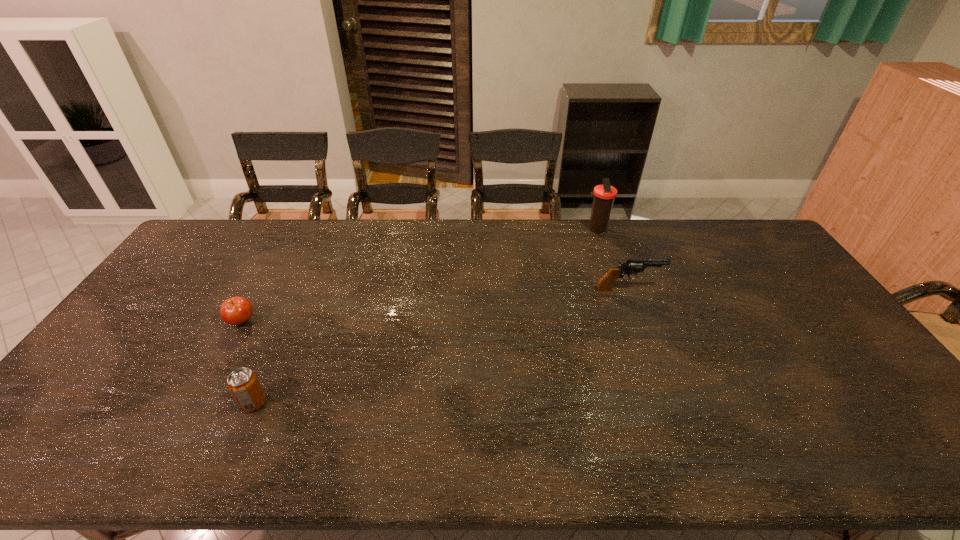
Locate an element on the screen. The width and height of the screenshot is (960, 540). the farthest object is located at coordinates (604, 195).

You are a GUI agent. You are given a task and a screenshot of the screen. Output one action in this format:
    pyautogui.click(x=<x>, y=<y>)
    Task: Click on the tallest object
    The height and width of the screenshot is (540, 960).
    Given the screenshot: What is the action you would take?
    pyautogui.click(x=604, y=195)

Find the location of a particular element. The width and height of the screenshot is (960, 540). the second tallest object is located at coordinates (632, 266).

I want to click on gun, so click(632, 266).

In order to click on the second shortest object in this screenshot , I will do `click(243, 384)`.

Find the location of a particular element. soda can is located at coordinates (243, 384).

Where is `the leftmost object`? Image resolution: width=960 pixels, height=540 pixels. the leftmost object is located at coordinates (237, 310).

You are a GUI agent. You are given a task and a screenshot of the screen. Output one action in this format:
    pyautogui.click(x=<x>, y=<y>)
    Task: Click on the apple
    This screenshot has width=960, height=540.
    Given the screenshot: What is the action you would take?
    pyautogui.click(x=237, y=310)

At what (x,y) coordinates should I click in order to perform the action: click on free space located on the left of the tallest object. Please return your answer as a coordinate pair (x, y). Image resolution: width=960 pixels, height=540 pixels. Looking at the image, I should click on (547, 230).

This screenshot has height=540, width=960. Find the location of `vacant space located along the barrel of the gun`. vacant space located along the barrel of the gun is located at coordinates (695, 290).